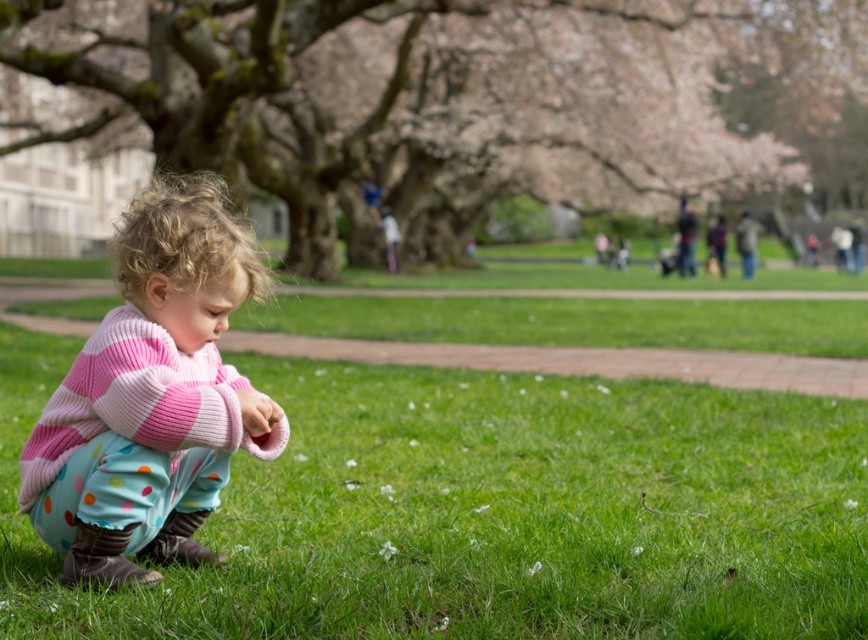
Question: Considering the real-world distances, which object is farthest from the green grass at lower left?

Choices:
 (A) pink knitted sweater at center
 (B) rough bark tree at center

Answer: (B)

Question: Which point is closer to the camera taking this photo?

Choices:
 (A) (126, 339)
 (B) (77, 304)

Answer: (A)

Question: Is rough bark tree at center positioned at the back of pink knitted sweater at center?

Choices:
 (A) no
 (B) yes

Answer: (B)

Question: Does rough bark tree at center appear under pink knitted sweater at center?

Choices:
 (A) no
 (B) yes

Answer: (A)

Question: Which object appears closest to the camera in this image?

Choices:
 (A) rough bark tree at center
 (B) green grass at lower left

Answer: (B)

Question: Considering the relative positions of rough bark tree at center and pink knitted sweater at center in the image provided, where is rough bark tree at center located with respect to pink knitted sweater at center?

Choices:
 (A) above
 (B) below

Answer: (A)